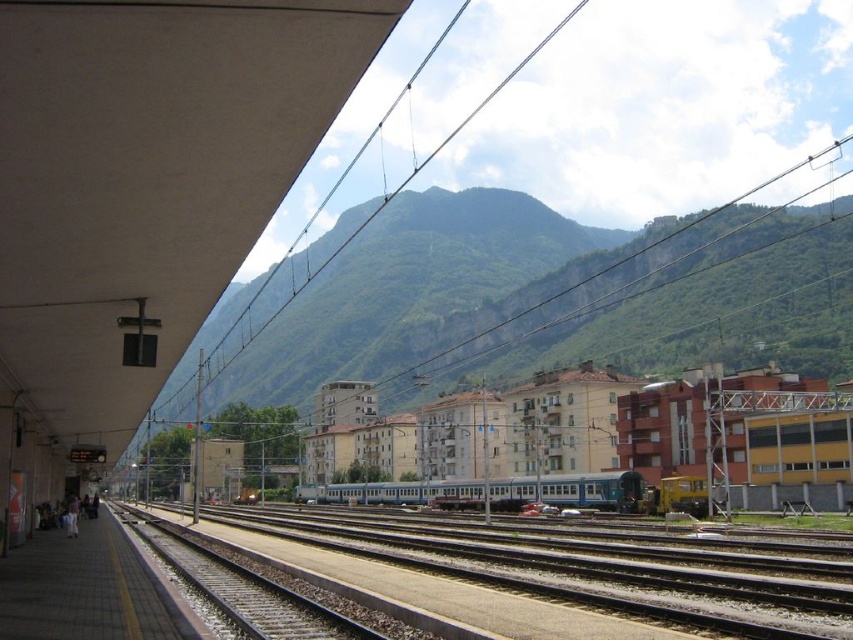
Question: Among these objects, which one is nearest to the camera?

Choices:
 (A) metallic tracks at center
 (B) silver metallic train at center

Answer: (A)

Question: Is metallic tracks at center positioned before silver metallic train at center?

Choices:
 (A) no
 (B) yes

Answer: (B)

Question: Among these objects, which one is nearest to the camera?

Choices:
 (A) metallic tracks at center
 (B) silver metallic train at center

Answer: (A)

Question: Can you confirm if metallic tracks at center is bigger than silver metallic train at center?

Choices:
 (A) no
 (B) yes

Answer: (A)

Question: Does metallic tracks at center appear on the right side of silver metallic train at center?

Choices:
 (A) no
 (B) yes

Answer: (A)